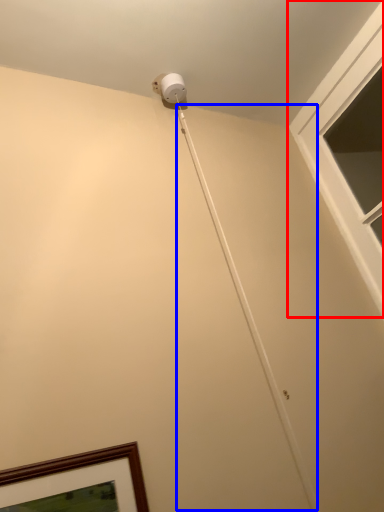
Question: Which object appears farthest to the camera in this image, window (highlighted by a red box) or string (highlighted by a blue box)?

Choices:
 (A) window
 (B) string

Answer: (A)